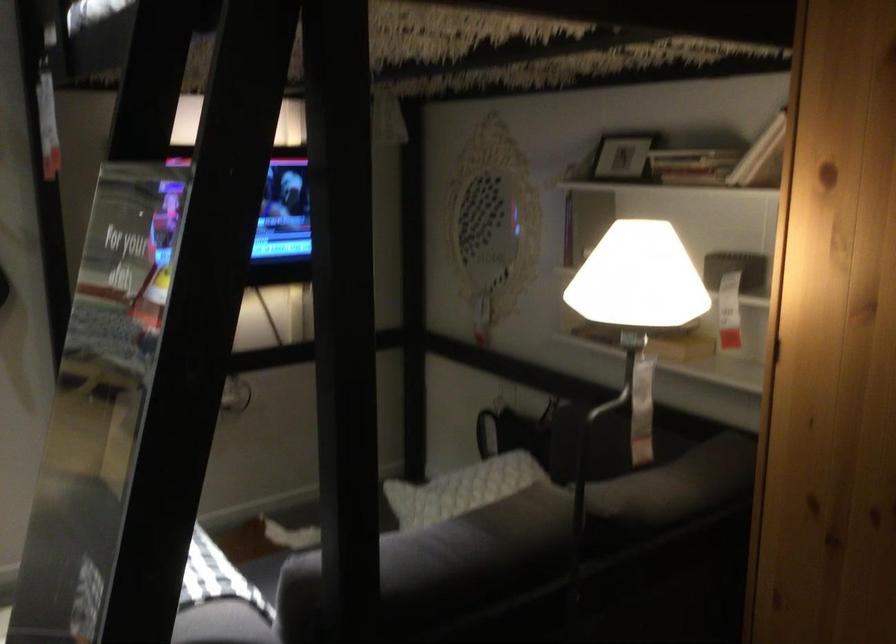
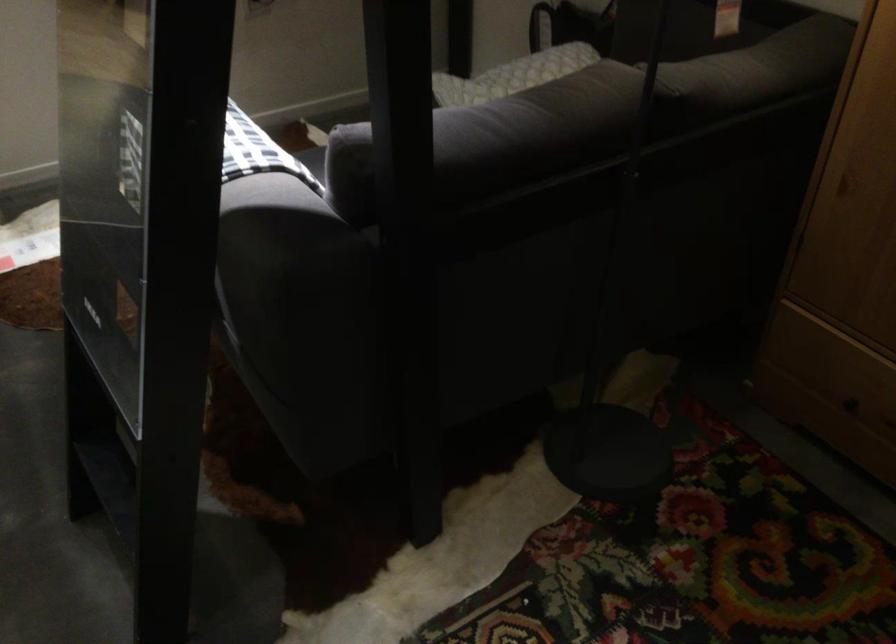
Find the pixel in the second image that matches point (475, 480) in the first image.

(528, 68)